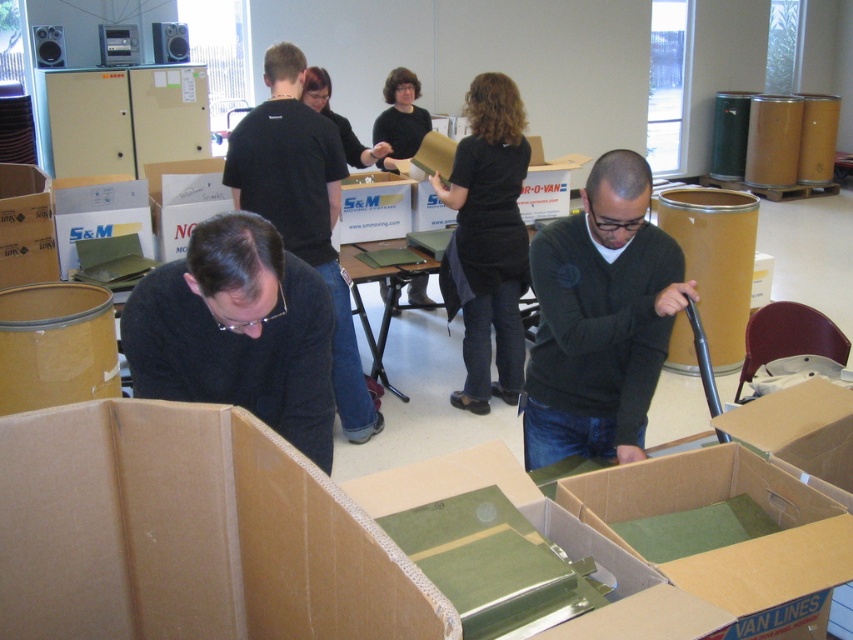
Who is positioned more to the left, black matte sweater at lower left or black matte shirt at center?

Positioned to the left is black matte sweater at lower left.

Can you confirm if black matte sweater at lower left is shorter than black matte shirt at center?

Correct, black matte sweater at lower left is not as tall as black matte shirt at center.

You are a GUI agent. You are given a task and a screenshot of the screen. Output one action in this format:
    pyautogui.click(x=<x>, y=<y>)
    Task: Click on the black matte sweater at lower left
    
    Given the screenshot: What is the action you would take?
    pyautogui.click(x=236, y=332)

Identify the location of black matte sweater at lower left. (236, 332).

Who is more distant from viewer, (161, 301) or (135, 200)?

The point (135, 200) is behind.

Who is shorter, black matte sweater at lower left or green cardboard box at left?

green cardboard box at left is shorter.

Which is in front, point (257, 360) or point (79, 221)?

Point (257, 360) is in front.

I want to click on black matte sweater at lower left, so click(236, 332).

Looking at this image, is black matte sweater at lower left below black matte shirt at upper center?

Correct, black matte sweater at lower left is located below black matte shirt at upper center.

Can you confirm if black matte sweater at lower left is shorter than black matte shirt at upper center?

Correct, black matte sweater at lower left is not as tall as black matte shirt at upper center.

The image size is (853, 640). Identify the location of black matte sweater at lower left. (236, 332).

What are the coordinates of `black matte sweater at lower left` in the screenshot? It's located at 236,332.